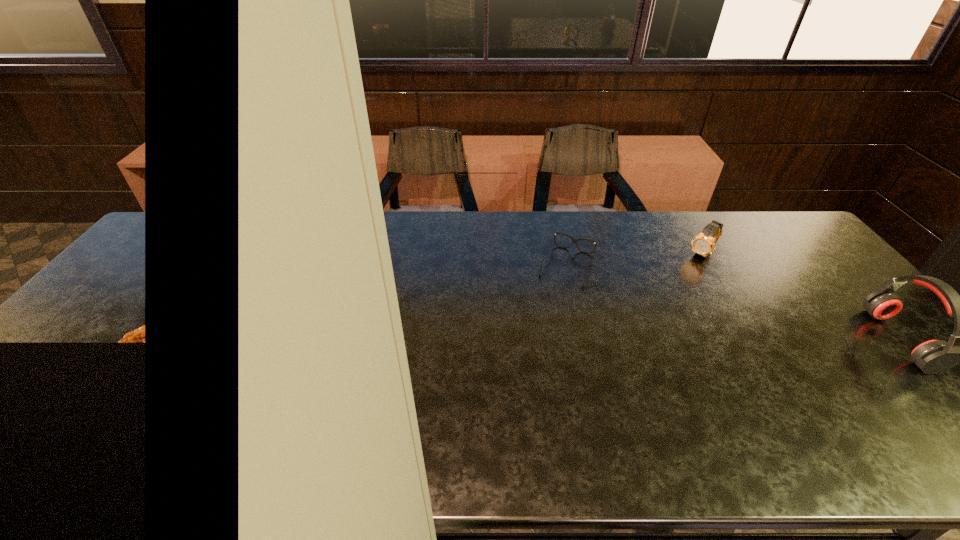
What are the coordinates of `the nearest object` in the screenshot? It's located at coord(935,356).

You are a GUI agent. You are given a task and a screenshot of the screen. Output one action in this format:
    pyautogui.click(x=<x>, y=<y>)
    Task: Click on the earphone
    This screenshot has height=540, width=960.
    Given the screenshot: What is the action you would take?
    pyautogui.click(x=935, y=356)

I want to click on the leftmost object, so click(x=573, y=240).

At what (x,y) coordinates should I click in order to perform the action: click on spectacles. Please return your answer as a coordinate pair (x, y). Looking at the image, I should click on (573, 240).

Where is `watch`? Image resolution: width=960 pixels, height=540 pixels. watch is located at coordinates (703, 244).

Find the location of a particular element. The height and width of the screenshot is (540, 960). the second object from right to left is located at coordinates (703, 244).

At what (x,y) coordinates should I click in order to perform the action: click on vacant region located on the ear cups of the earphone. Please return your answer as a coordinate pair (x, y). The image size is (960, 540). Looking at the image, I should click on (734, 340).

I want to click on free spot located 0.340m on the ear cups of the earphone, so click(x=754, y=340).

The image size is (960, 540). I want to click on vacant space located 0.360m on the ear cups of the earphone, so click(x=746, y=340).

This screenshot has height=540, width=960. Identify the location of vacant region located 0.050m with the lenses facing outward on the leftmost object. (556, 296).